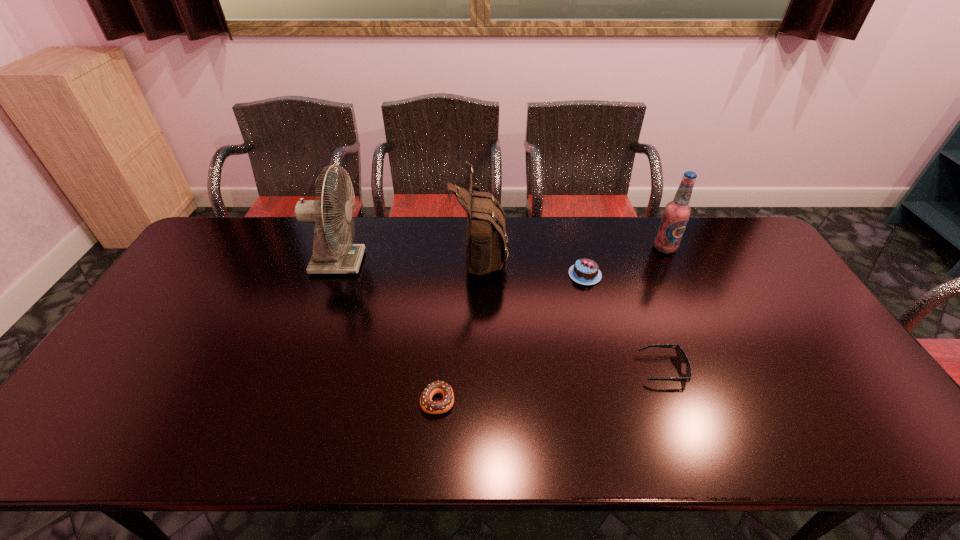
You are a GUI agent. You are given a task and a screenshot of the screen. Output one action in this format:
    pyautogui.click(x=<x>, y=<y>)
    Task: Click on the vacant region between the fourth tallest object and the doughnut
    
    Given the screenshot: What is the action you would take?
    pyautogui.click(x=512, y=338)

Where is `free space between the rightmost object and the third shortest object`? Image resolution: width=960 pixels, height=540 pixels. free space between the rightmost object and the third shortest object is located at coordinates (625, 261).

This screenshot has height=540, width=960. What are the coordinates of `vacant area that lies between the fourth tallest object and the rightmost object` in the screenshot? It's located at click(625, 261).

Find the location of a particular element. This screenshot has height=540, width=960. free spot between the shoulder bag and the alcohol is located at coordinates (572, 250).

At what (x,y) coordinates should I click in order to perform the action: click on object identified as the fifth closest to the doughnut. Please return your answer as a coordinate pair (x, y). This screenshot has width=960, height=540. Looking at the image, I should click on (676, 214).

Choose which object is the fifth nearest neighbor to the doughnut. Please provide its 2D coordinates. Your answer should be formatted as a tuple, i.e. [(x, y)], where the tuple contains the x and y coordinates of a point satisfying the conditions above.

[(676, 214)]

At what (x,y) coordinates should I click in order to perform the action: click on vacant space that satisfies the following two spatial constraints: 1. on the front-facing side of the third object from right to left; 2. on the left side of the shoulder bag. Please return your answer as a coordinate pair (x, y). The height and width of the screenshot is (540, 960). Looking at the image, I should click on (480, 275).

This screenshot has width=960, height=540. I want to click on free location that satisfies the following two spatial constraints: 1. on the back side of the alcohol; 2. on the right side of the doughnut, so click(449, 248).

You are a GUI agent. You are given a task and a screenshot of the screen. Output one action in this format:
    pyautogui.click(x=<x>, y=<y>)
    Task: Click on the vacant position in the image that satisfies the following two spatial constraints: 1. on the front-facing side of the sunglasses; 2. on the front side of the doughnut
    The width and height of the screenshot is (960, 540).
    Given the screenshot: What is the action you would take?
    pyautogui.click(x=674, y=401)

Find the location of a particular element. This screenshot has height=540, width=960. vacant position in the image that satisfies the following two spatial constraints: 1. on the front-facing side of the fourth object from left to right; 2. on the right side of the fan is located at coordinates (333, 275).